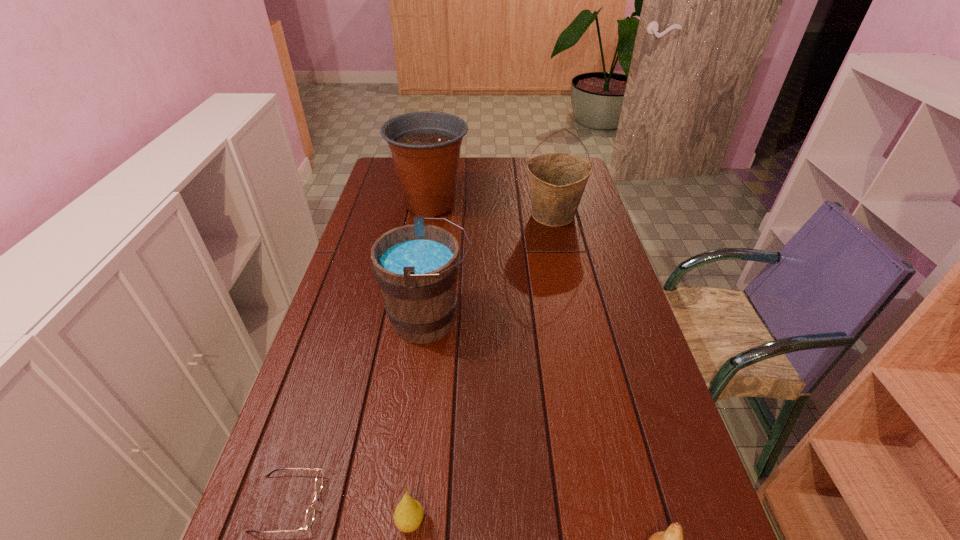
You are a GUI agent. You are given a task and a screenshot of the screen. Output one action in this format:
    pyautogui.click(x=<x>, y=<y>)
    Task: Click on the vacant space located 0.250m on the back of the farther pear
    
    Given the screenshot: What is the action you would take?
    pyautogui.click(x=424, y=395)

Locate an element on the screen. The height and width of the screenshot is (540, 960). free spot located 0.090m on the lenses of the spectacles is located at coordinates (366, 503).

Locate an element on the screen. This screenshot has height=540, width=960. flowerpot that is at the left edge is located at coordinates (425, 146).

I want to click on spectacles located in the left edge section of the desktop, so click(310, 513).

Find the location of a particular element. The height and width of the screenshot is (540, 960). object situated at the right edge is located at coordinates (557, 181).

In the image, there is a desktop. Where is `vacant area at the left edge`? The image size is (960, 540). vacant area at the left edge is located at coordinates (366, 218).

This screenshot has height=540, width=960. Find the location of `vacant space at the right edge of the desktop`. vacant space at the right edge of the desktop is located at coordinates (587, 274).

Identify the location of vacant region at the far left corner of the desktop. click(x=375, y=177).

Locate an element on the screen. The width and height of the screenshot is (960, 540). free space between the flowerpot and the farther pear is located at coordinates point(420,363).

You are a GUI agent. You are given a task and a screenshot of the screen. Output one action in this format:
    pyautogui.click(x=<x>, y=<y>)
    Task: Click on the unoccupied area between the flowerpot and the left pear
    This screenshot has height=540, width=960.
    Given the screenshot: What is the action you would take?
    pyautogui.click(x=420, y=363)